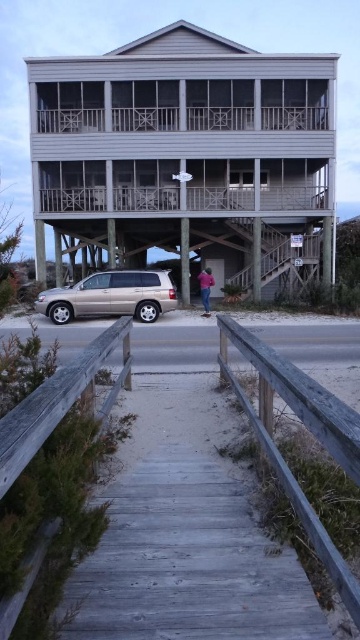
Question: Where is weathered wood boardwalk at center located in relation to wooden rail at center in the image?

Choices:
 (A) below
 (B) above

Answer: (A)

Question: Which of these objects is positioned closest to the pink fabric at lower center?

Choices:
 (A) wooden rail at center
 (B) gold metallic minivan at lower left

Answer: (B)

Question: Considering the relative positions of wooden rail at center and pink fabric at lower center in the image provided, where is wooden rail at center located with respect to pink fabric at lower center?

Choices:
 (A) above
 (B) below

Answer: (B)

Question: Among these points, which one is nearest to the camera?

Choices:
 (A) (163, 278)
 (B) (173, 481)
 (C) (209, 296)

Answer: (B)

Question: Which of the following is the closest to the observer?

Choices:
 (A) gold metallic minivan at lower left
 (B) weathered wood boardwalk at center
 (C) wooden rail at center

Answer: (C)

Question: Does weathered wood boardwalk at center appear on the right side of wooden rail at center?

Choices:
 (A) yes
 (B) no

Answer: (B)